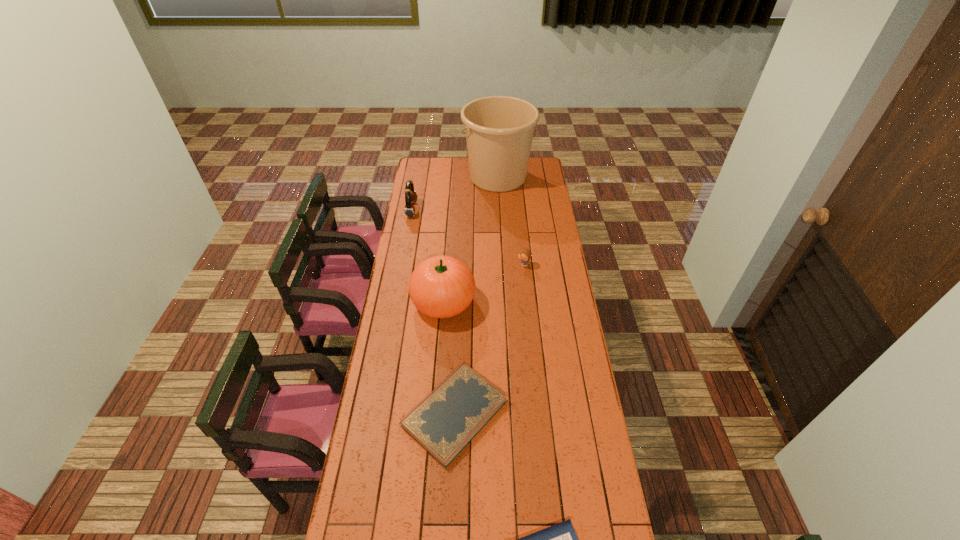
This screenshot has width=960, height=540. Identify the location of free region located on the left of the farthest object. (439, 177).

The height and width of the screenshot is (540, 960). What are the coordinates of `vacant space located on the back of the fourth farthest object` in the screenshot? It's located at (445, 271).

The image size is (960, 540). In order to click on vacant space located 0.230m on the ear cup of the leftmost object in this screenshot , I will do `click(458, 210)`.

Locate an element on the screen. vacant region located 0.140m on the front-facing side of the duck is located at coordinates (488, 265).

This screenshot has width=960, height=540. Find the location of `free location located on the front-facing side of the duck`. free location located on the front-facing side of the duck is located at coordinates (475, 265).

The width and height of the screenshot is (960, 540). I want to click on free location located 0.380m on the front-facing side of the duck, so click(439, 265).

Image resolution: width=960 pixels, height=540 pixels. I want to click on blank space located 0.160m on the back of the farther paperback book, so click(459, 335).

The image size is (960, 540). In order to click on object located at the far edge in this screenshot , I will do `click(499, 130)`.

Identify the location of pumpkin present at the left edge. (442, 286).

At what (x,y) coordinates should I click in order to perform the action: click on headset situated at the left edge. Please return your answer as a coordinate pair (x, y). Looking at the image, I should click on (410, 195).